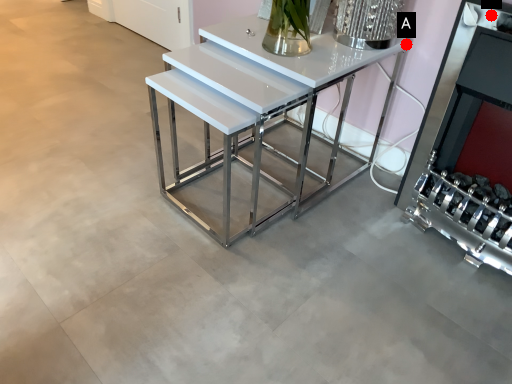
Question: Two points are circled on the image, labeled by A and B beside each circle. Which point is closer to the camera?

Choices:
 (A) A is closer
 (B) B is closer

Answer: (B)